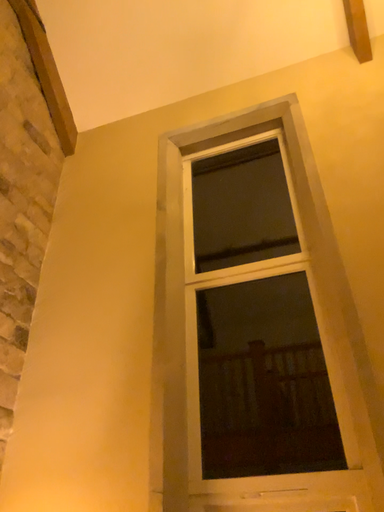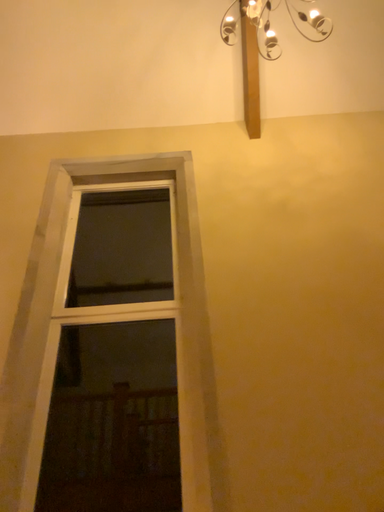
Question: Which way did the camera rotate in the video?

Choices:
 (A) rotated left
 (B) rotated right

Answer: (B)